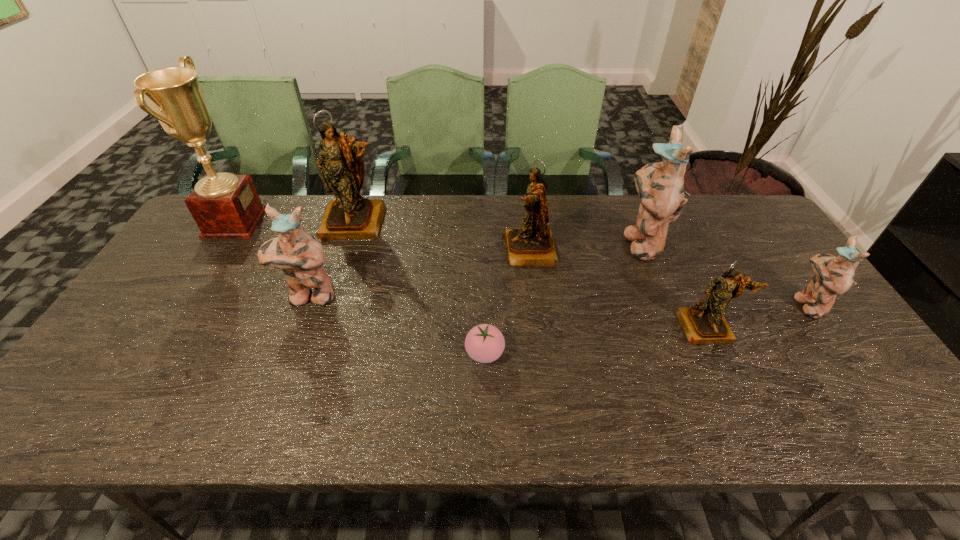
The image size is (960, 540). Find the location of `the tallest object`. the tallest object is located at coordinates (224, 205).

Find the location of a particular element. The image size is (960, 540). the leftmost object is located at coordinates pyautogui.click(x=224, y=205).

You are a GUI agent. You are given a task and a screenshot of the screen. Output one action in this format:
    pyautogui.click(x=<x>, y=<y>)
    Task: Click on the biggest pink figurine
    This screenshot has width=960, height=540.
    Given the screenshot: What is the action you would take?
    pyautogui.click(x=660, y=186)

Where is `the second pink figurine from right to left`? Image resolution: width=960 pixels, height=540 pixels. the second pink figurine from right to left is located at coordinates (660, 186).

Where is `the biggest gold figurine`? the biggest gold figurine is located at coordinates 350,216.

Locate an element on the screen. the third figurine from left to right is located at coordinates (532, 245).

The width and height of the screenshot is (960, 540). I want to click on the second biggest gold figurine, so click(532, 245).

The height and width of the screenshot is (540, 960). Identify the location of the second smallest pink figurine. pyautogui.click(x=300, y=256).

Locate an element on the screen. This screenshot has height=540, width=960. the rightmost object is located at coordinates (833, 276).

Locate an element on the screen. the rightmost pink figurine is located at coordinates (833, 276).